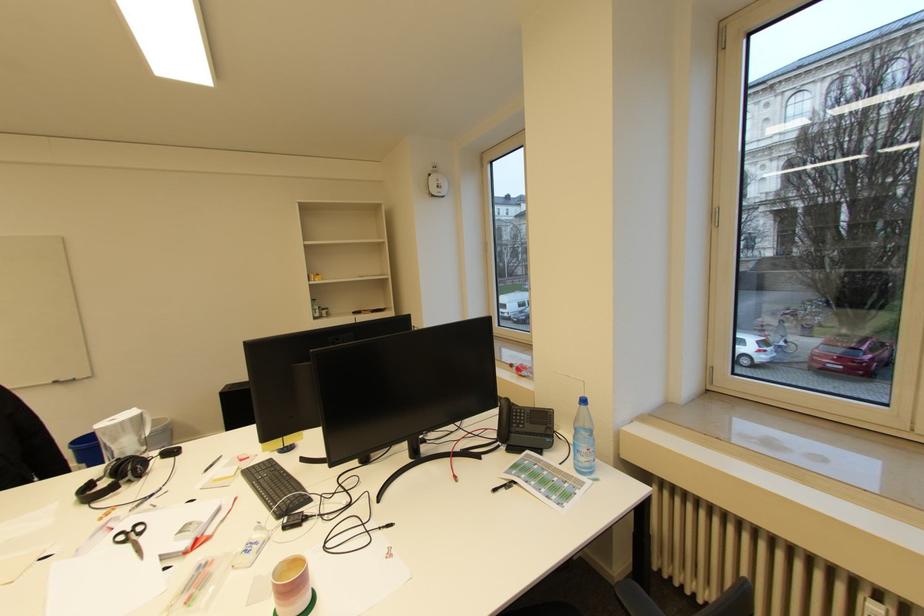
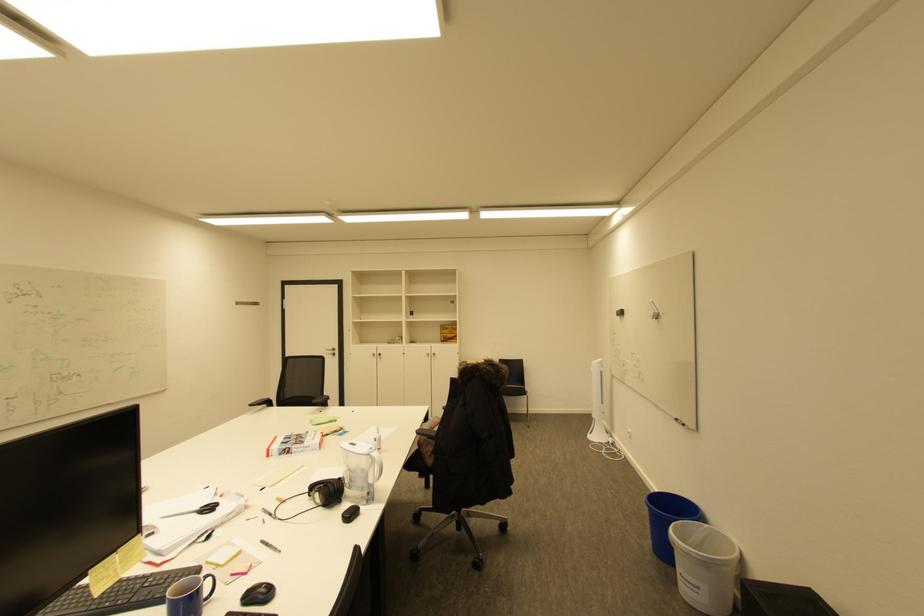
The point at (x=141, y=525) is marked in the first image. Where is the corresponding point in the second image?

(220, 508)